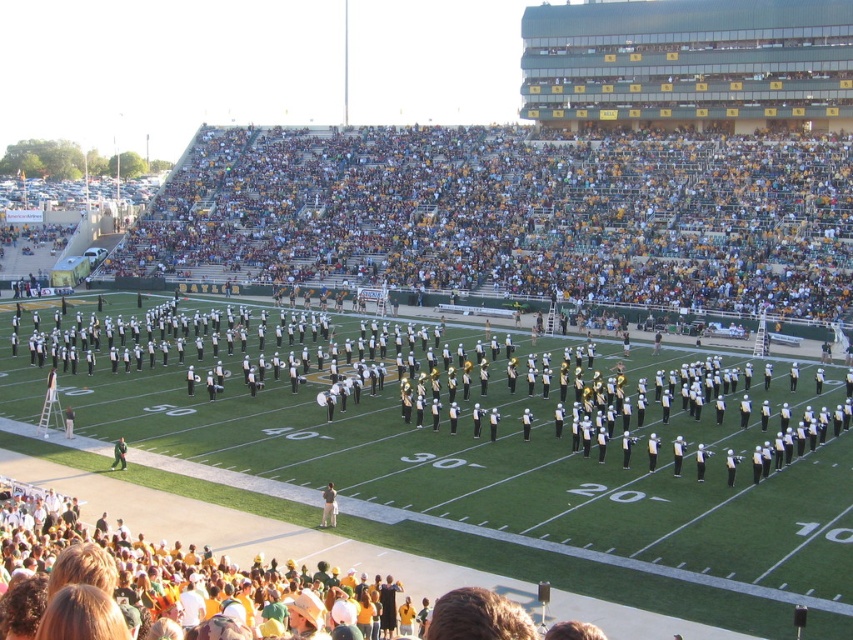
You are a photographer at the football stadium trying to capture the marching band performance. You notice the white cotton shirt at lower center and the green uniformed person at lower left in your viewfinder. Which object is positioned to the right of the other?

The white cotton shirt at lower center is positioned to the right of the green uniformed person at lower left.